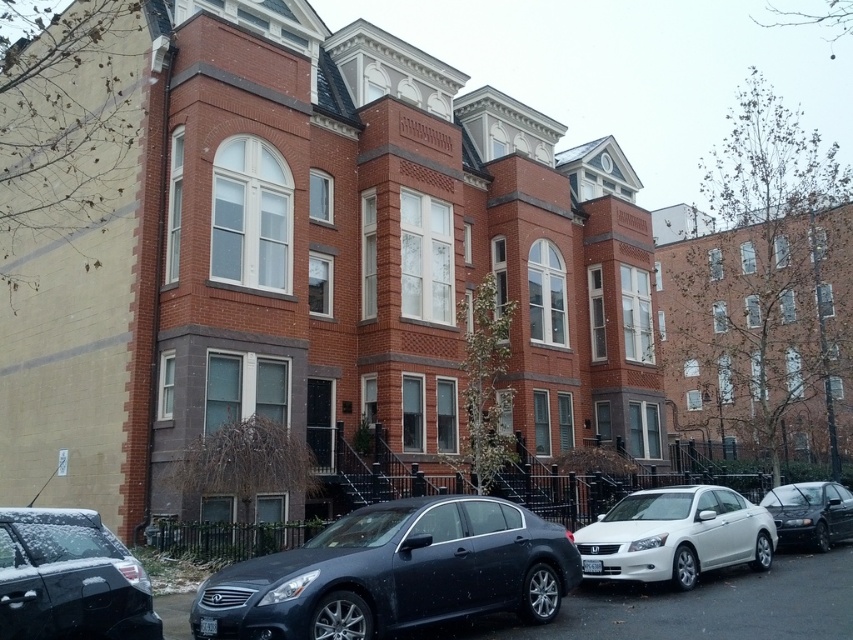
Question: Where is shiny black sedan at lower left located in relation to shiny black sedan at center in the image?

Choices:
 (A) right
 (B) left

Answer: (B)

Question: Which of the following is the farthest from the observer?

Choices:
 (A) (618, 573)
 (B) (566, 570)
 (C) (833, 532)

Answer: (C)

Question: Which object is positioned farthest from the satin black sedan at center?

Choices:
 (A) shiny black sedan at center
 (B) shiny black sedan at lower left

Answer: (A)

Question: Which point is farther from the camera taking this photo?

Choices:
 (A) (120, 582)
 (B) (432, 605)

Answer: (B)

Question: Does satin black sedan at center appear on the left side of white glossy sedan at center?

Choices:
 (A) yes
 (B) no

Answer: (A)

Question: Does satin black sedan at center appear on the left side of white glossy sedan at center?

Choices:
 (A) yes
 (B) no

Answer: (A)